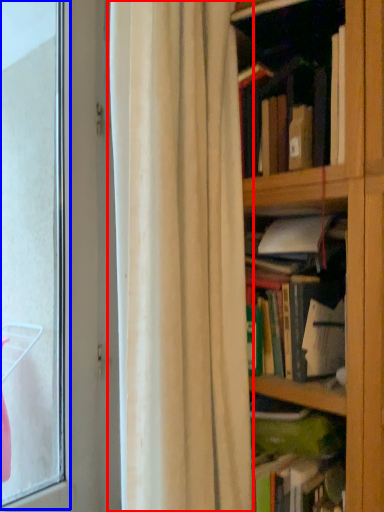
Question: Which of the following is the farthest to the observer, curtain (highlighted by a red box) or bay window (highlighted by a blue box)?

Choices:
 (A) curtain
 (B) bay window

Answer: (B)